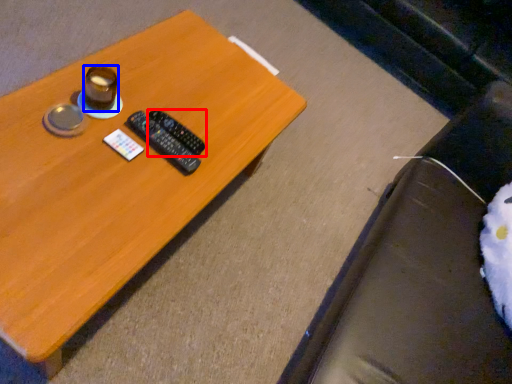
Question: Which object is closer to the camera taking this photo, remote control (highlighted by a red box) or coffee cup (highlighted by a blue box)?

Choices:
 (A) remote control
 (B) coffee cup

Answer: (B)